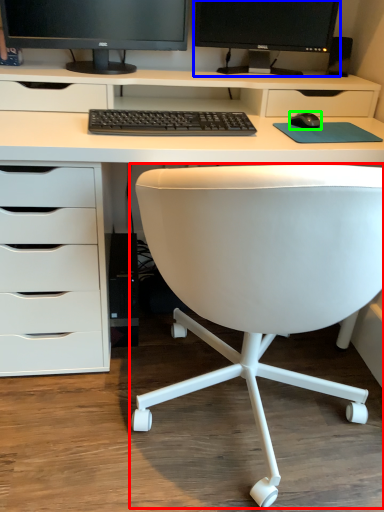
Question: Which object is positioned farthest from chair (highlighted by a red box)? Select from computer monitor (highlighted by a blue box) and office supplies (highlighted by a green box).

Choices:
 (A) computer monitor
 (B) office supplies

Answer: (A)